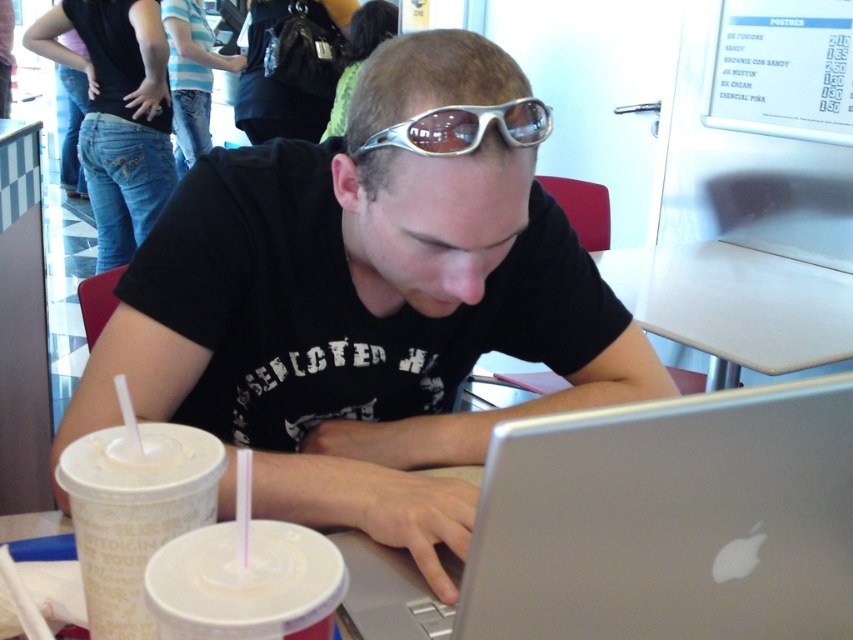
Question: Which point is closer to the camera taking this photo?

Choices:
 (A) (219, 632)
 (B) (97, 550)

Answer: (A)

Question: Which object is the farthest from the silver metallic goggles at center?

Choices:
 (A) black matte shirt at center
 (B) silver metallic laptop at center

Answer: (B)

Question: In this image, where is white plastic table at center located relative to white matte cup at lower center?

Choices:
 (A) right
 (B) left

Answer: (A)

Question: Can you confirm if black matte shirt at center is wider than silver metallic laptop at center?

Choices:
 (A) no
 (B) yes

Answer: (B)

Question: Is white matte cup at lower center above silver metallic goggles at center?

Choices:
 (A) no
 (B) yes

Answer: (A)

Question: Which object is the farthest from the black matte shirt at center?

Choices:
 (A) silver metallic goggles at center
 (B) silver metallic laptop at center
 (C) white plastic table at center

Answer: (C)